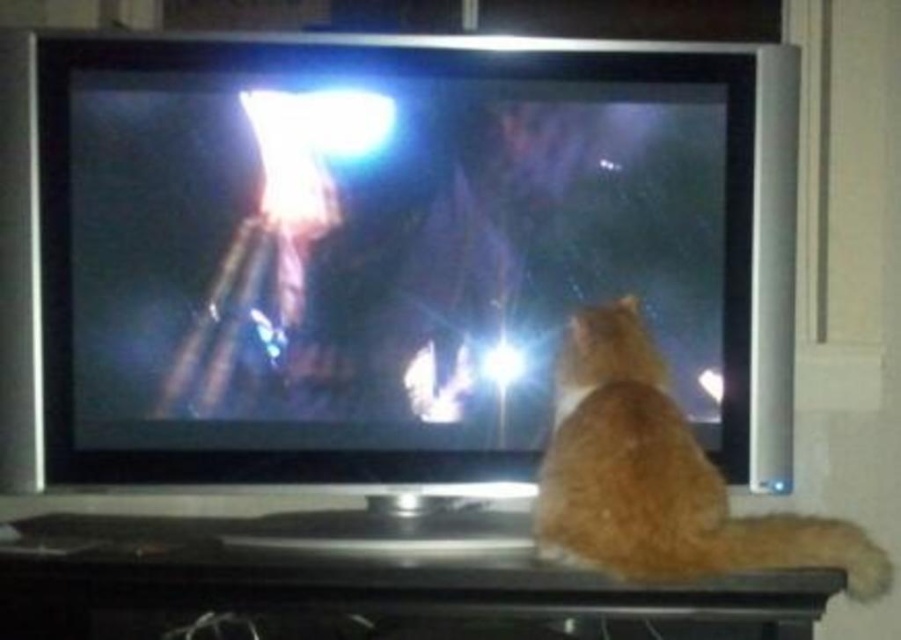
Describe the element at coordinates (380, 250) in the screenshot. I see `metallic silver flat at center` at that location.

Does metallic silver flat at center have a lesser width compared to orange fur cat at lower right?

No.

Who is more distant from viewer, (476, 282) or (666, 381)?

Point (476, 282)

Find the location of a particular element. metallic silver flat at center is located at coordinates (380, 250).